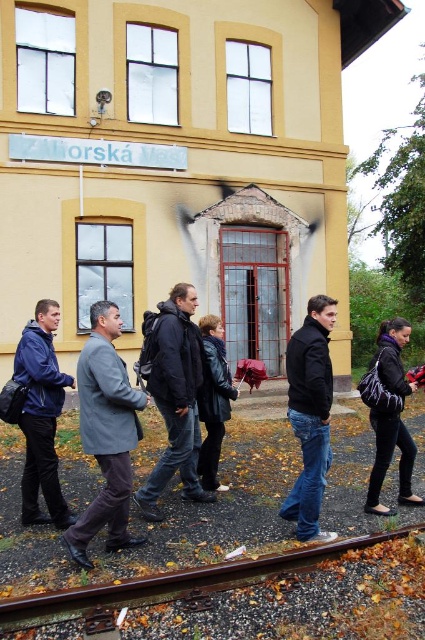
From the picture: Does gray wool coat at center appear over purple fabric backpack at lower right?

Yes.

Who is more forward, [90,381] or [374,397]?

Point [90,381] is in front.

Where is `gray wool coat at center`? The height and width of the screenshot is (640, 425). gray wool coat at center is located at coordinates (105, 433).

Who is positioned more to the left, black matte jacket at center or purple fabric backpack at lower right?

black matte jacket at center

Who is taller, black matte jacket at center or purple fabric backpack at lower right?

black matte jacket at center is taller.

Describe the element at coordinates (309, 413) in the screenshot. The height and width of the screenshot is (640, 425). I see `black matte jacket at center` at that location.

Identify the location of black matte jacket at center. Image resolution: width=425 pixels, height=640 pixels. (309, 413).

From the picture: Is brown metallic train track at lower center smaller than purple fabric backpack at lower right?

Yes, brown metallic train track at lower center is smaller than purple fabric backpack at lower right.

Can you confirm if brown metallic train track at lower center is taller than purple fabric backpack at lower right?

Incorrect, brown metallic train track at lower center's height is not larger of purple fabric backpack at lower right's.

Image resolution: width=425 pixels, height=640 pixels. I want to click on brown metallic train track at lower center, so click(257, 598).